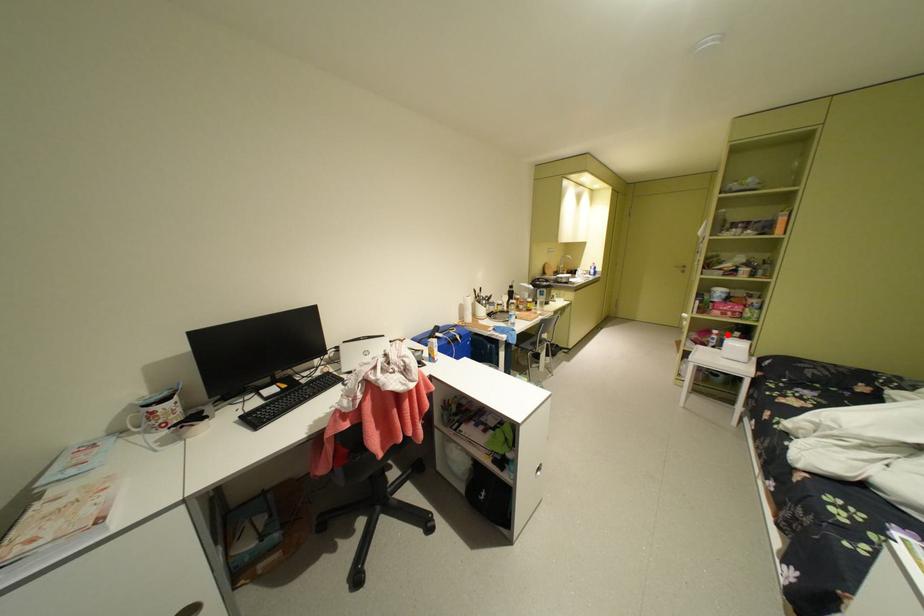
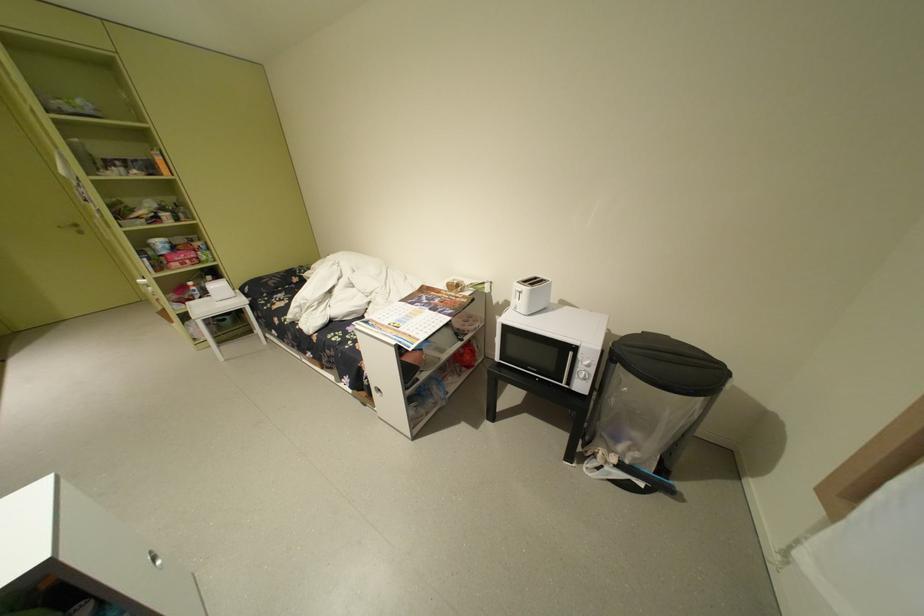
Question: I am providing you with two images of the same scene from different viewpoints. Given a red point in image1, look at the same physical point in image2. Is it:

Choices:
 (A) Closer to the viewpoint
 (B) Farther from the viewpoint

Answer: (B)